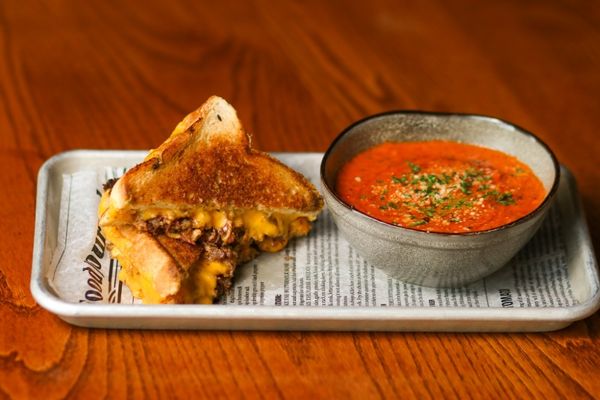
Where is `tray`? The width and height of the screenshot is (600, 400). tray is located at coordinates (35, 295).